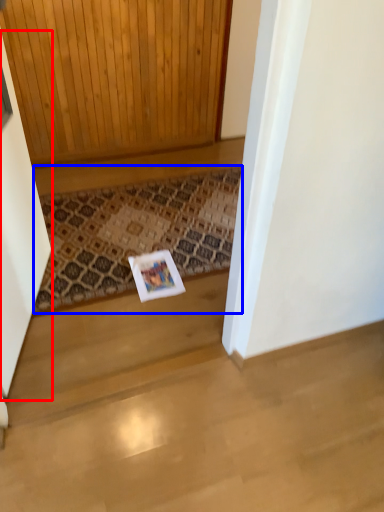
Question: Which of the following is the closest to the observer, screen door (highlighted by a red box) or doormat (highlighted by a blue box)?

Choices:
 (A) screen door
 (B) doormat

Answer: (A)